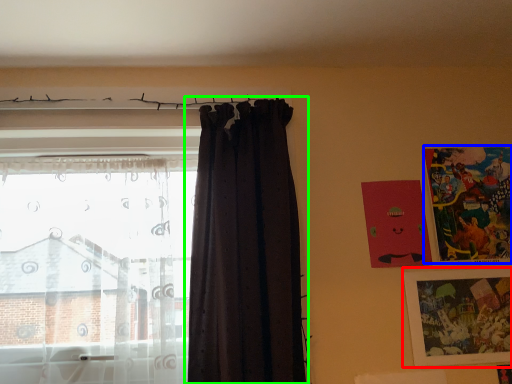
Question: Considering the real-world distances, which object is closest to picture frame (highlighted by a red box)? picture frame (highlighted by a blue box) or curtain (highlighted by a green box).

Choices:
 (A) picture frame
 (B) curtain

Answer: (A)